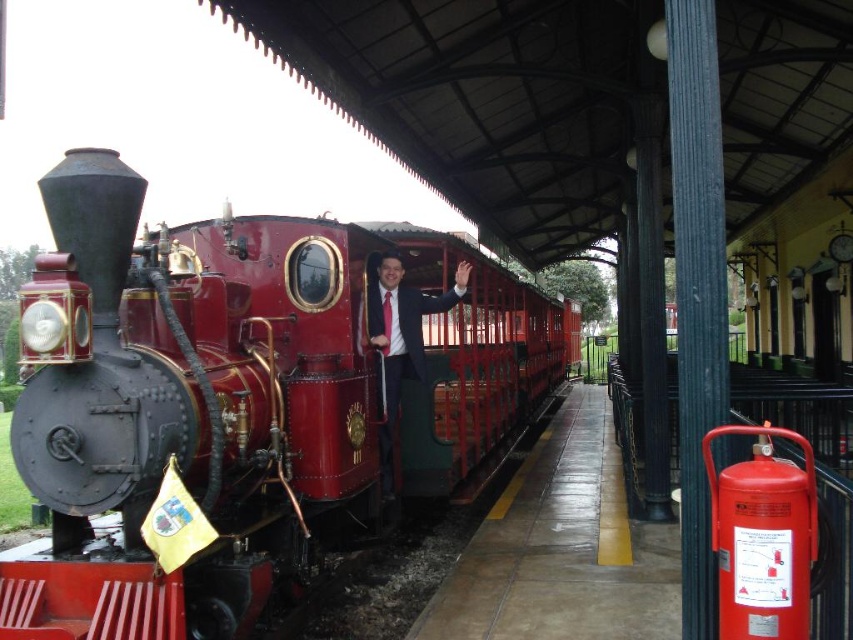
You are a passenger on the train and want to reach the shiny red locomotive at center from your current position near the matte black suit at center. Can you walk directly to it without needing to move past any obstacles?

The shiny red locomotive at center and matte black suit at center are 2.75 meters apart. Since there are no obstacles mentioned in the scene description, you can walk directly to the shiny red locomotive at center from the matte black suit at center.